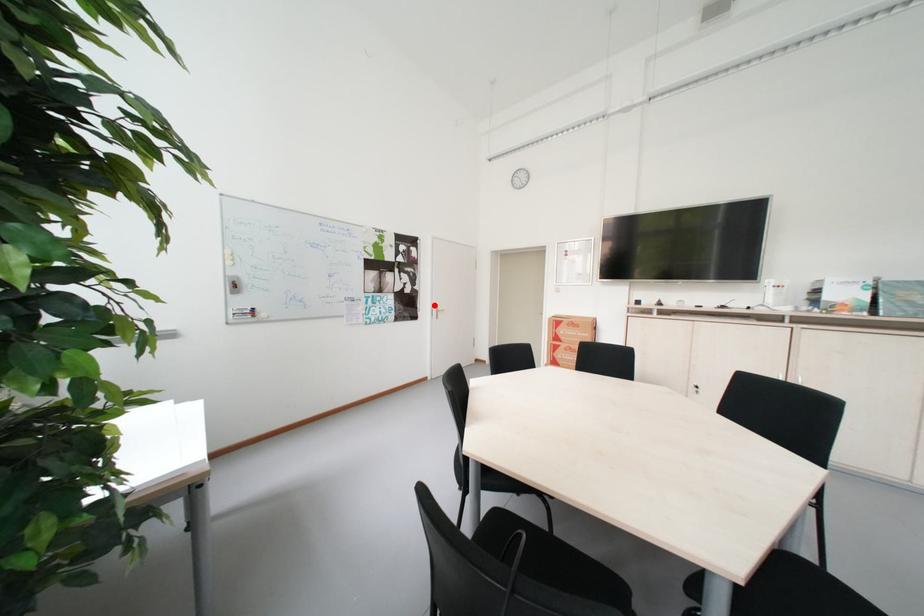
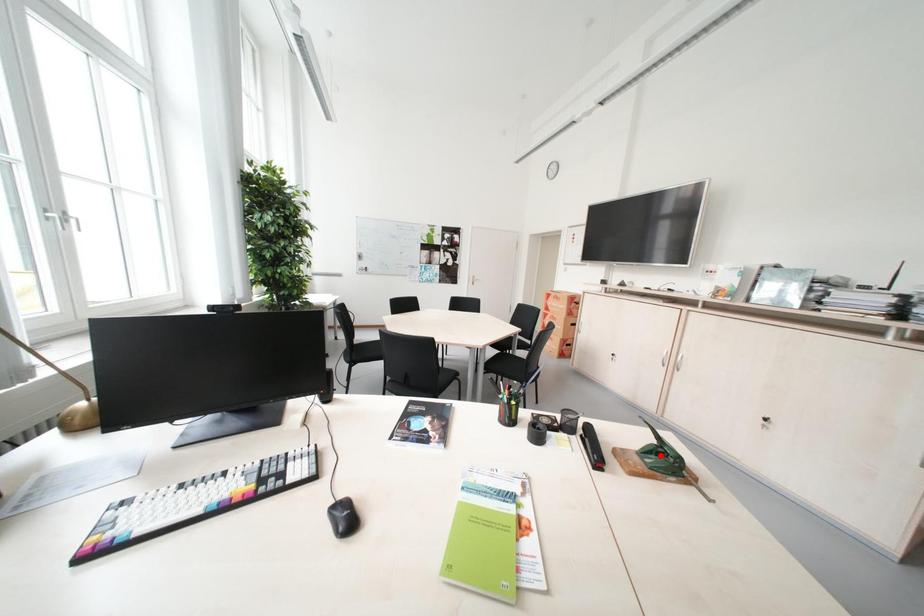
I am providing you with two images of the same scene from different viewpoints. A red point is marked on the first image and another point is marked on the second image. Is the red point in image1 aligned with the point shown in image2?

No